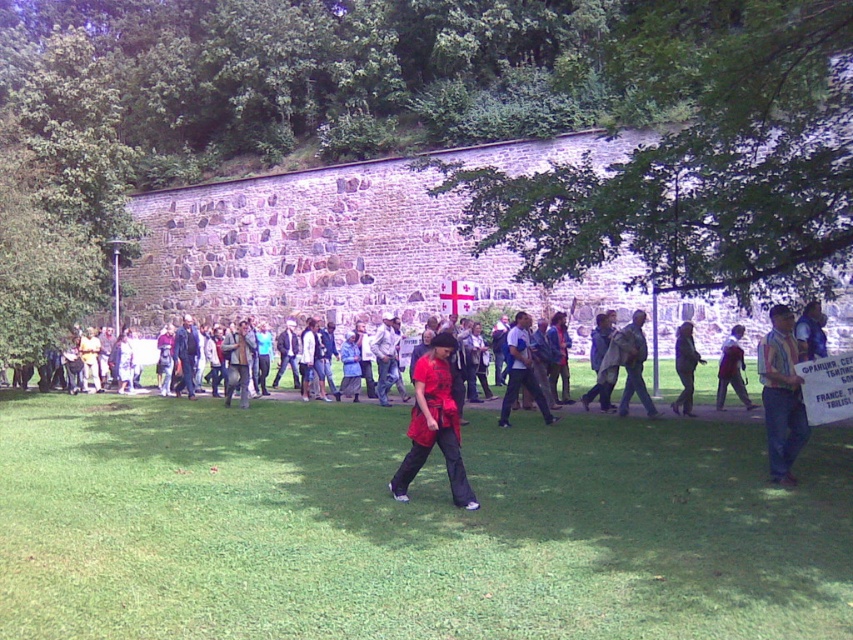
Is red shirt at center bigger than dark blue jeans at center?

No.

Is red shirt at center above dark blue jeans at center?

Yes, red shirt at center is above dark blue jeans at center.

Who is more distant from viewer, (521, 316) or (688, 406)?

Point (688, 406)

I want to click on red shirt at center, so click(x=521, y=371).

Where is `dark blue jeans at center`? This screenshot has width=853, height=640. dark blue jeans at center is located at coordinates [x=685, y=368].

Who is taller, dark blue jeans at center or white fabric cross at center?

dark blue jeans at center is taller.

Does point (679, 340) come behind point (450, 282)?

No, (679, 340) is closer to viewer.

Image resolution: width=853 pixels, height=640 pixels. What are the coordinates of `dark blue jeans at center` in the screenshot? It's located at (685, 368).

Is matte black jacket at center thinner than white fabric cross at center?

No, matte black jacket at center is not thinner than white fabric cross at center.

Between matte black jacket at center and white fabric cross at center, which one is positioned lower?

Positioned lower is matte black jacket at center.

The height and width of the screenshot is (640, 853). What are the coordinates of `matte black jacket at center` in the screenshot? It's located at (635, 365).

Where is `matte black jacket at center`? The image size is (853, 640). matte black jacket at center is located at coordinates (635, 365).